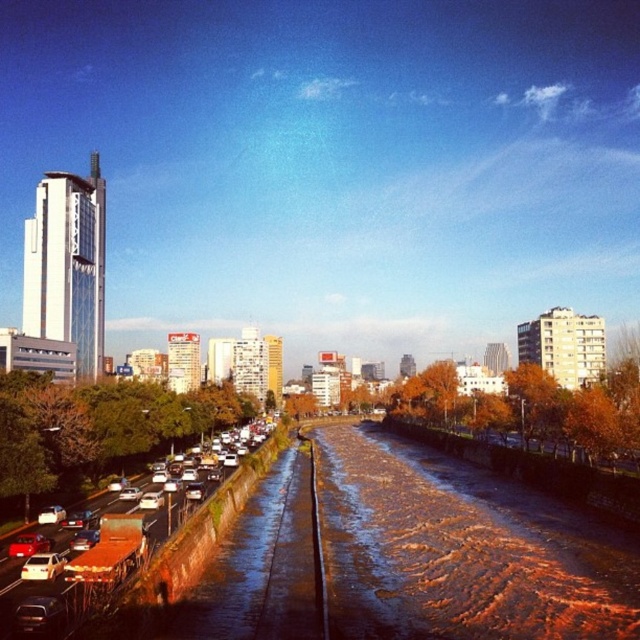
Question: Is metallic silver cars at left closer to the viewer compared to matte red car at lower left?

Choices:
 (A) yes
 (B) no

Answer: (A)

Question: Which of these objects is positioned closest to the matte red car at lower left?

Choices:
 (A) metallic silver sedan at lower left
 (B) metallic silver cars at left

Answer: (A)

Question: Where is metallic silver cars at left located in relation to matte red car at lower left in the image?

Choices:
 (A) above
 (B) below

Answer: (B)

Question: Is metallic silver sedan at lower left to the left of matte red car at lower left from the viewer's perspective?

Choices:
 (A) no
 (B) yes

Answer: (A)

Question: Which is nearer to the matte red car at lower left?

Choices:
 (A) metallic silver cars at left
 (B) metallic silver sedan at lower left

Answer: (B)

Question: Which is nearer to the metallic silver cars at left?

Choices:
 (A) metallic silver sedan at lower left
 (B) matte red car at lower left

Answer: (A)